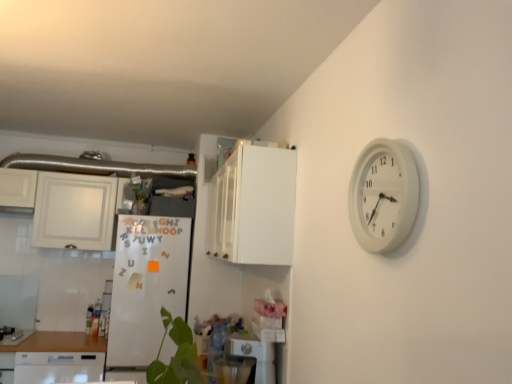
I want to click on blank space above white plastic dishwasher at lower center (from a real-world perspective), so click(247, 337).